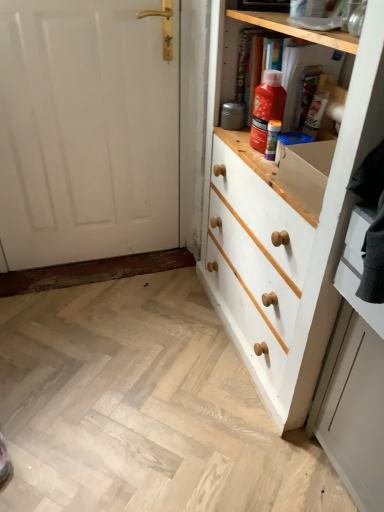
Where is `purple plastic tube at upper center`? The width and height of the screenshot is (384, 512). purple plastic tube at upper center is located at coordinates (272, 139).

The width and height of the screenshot is (384, 512). In order to click on white painted wood chest of drawers at right in this screenshot , I will do pyautogui.click(x=293, y=244).

In order to face white painted wood chest of drawers at right, should I rotate leftwards or rightwards?

You should rotate right by 13.302 degrees.

I want to click on white painted wood drawer at right, so click(357, 269).

Is matte orange plastic bottle at upper center outside of purple plastic tube at upper center?

matte orange plastic bottle at upper center lies outside purple plastic tube at upper center's area.

Is matte orange plastic bottle at upper center bigger than purple plastic tube at upper center?

Correct, matte orange plastic bottle at upper center is larger in size than purple plastic tube at upper center.

Is matte orange plastic bottle at upper center not near purple plastic tube at upper center?

No.

From the image's perspective, who appears lower, matte orange plastic bottle at upper center or purple plastic tube at upper center?

purple plastic tube at upper center.

From the image's perspective, between white painted wood drawer at right and white painted wood door at left, which one is located above?

From the image's view, white painted wood door at left is above.

Is white painted wood drawer at right further to camera compared to white painted wood door at left?

No.

Looking at this image, considering the relative sizes of white painted wood drawer at right and white painted wood door at left in the image provided, is white painted wood drawer at right shorter than white painted wood door at left?

Yes, white painted wood drawer at right is shorter than white painted wood door at left.

Is white painted wood drawer at right at the back of white painted wood door at left?

white painted wood door at left does not have its back to white painted wood drawer at right.

Consider the image. From the image's perspective, which one is positioned lower, white painted wood door at left or white painted wood drawer at right?

white painted wood drawer at right appears lower in the image.

Considering the sizes of objects white painted wood door at left and white painted wood drawer at right in the image provided, who is bigger, white painted wood door at left or white painted wood drawer at right?

white painted wood door at left.

Which object is further away from the camera taking this photo, white painted wood door at left or white painted wood drawer at right?

Positioned behind is white painted wood door at left.

Who is shorter, white painted wood door at left or white painted wood chest of drawers at right?

Standing shorter between the two is white painted wood door at left.

Which object is further away from the camera, white painted wood door at left or white painted wood chest of drawers at right?

white painted wood door at left is more distant.

Consider the image. How different are the orientations of white painted wood door at left and white painted wood chest of drawers at right in degrees?

white painted wood door at left and white painted wood chest of drawers at right are facing 88.9 degrees away from each other.

Can you confirm if purple plastic tube at upper center is positioned to the right of white painted wood door at left?

Indeed, purple plastic tube at upper center is positioned on the right side of white painted wood door at left.

Considering the positions of point (270, 150) and point (132, 184), is point (270, 150) closer or farther from the camera than point (132, 184)?

Point (270, 150) is closer to the camera than point (132, 184).

Locate an element on the screen. Image resolution: width=384 pixels, height=512 pixels. door located underneath the purple plastic tube at upper center (from a real-world perspective) is located at coordinates (86, 131).

Is white painted wood chest of drawers at right further to camera compared to white painted wood door at left?

That is False.

Can you tell me how much white painted wood chest of drawers at right and white painted wood door at left differ in facing direction?

The angle between the facing direction of white painted wood chest of drawers at right and the facing direction of white painted wood door at left is 88.9 degrees.

Is there a large distance between white painted wood chest of drawers at right and white painted wood door at left?

That's not correct — white painted wood chest of drawers at right is a little close to white painted wood door at left.

Between point (233, 213) and point (94, 188), which one is positioned in front?

Positioned in front is point (233, 213).

From a real-world perspective, is purple plastic tube at upper center under white painted wood chest of drawers at right?

No, from a real-world perspective, purple plastic tube at upper center is not under white painted wood chest of drawers at right.

Is purple plastic tube at upper center surrounding white painted wood chest of drawers at right?

No, white painted wood chest of drawers at right is not a part of purple plastic tube at upper center.

Which object is positioned more to the right, purple plastic tube at upper center or white painted wood chest of drawers at right?

From the viewer's perspective, white painted wood chest of drawers at right appears more on the right side.

From the picture: Is purple plastic tube at upper center wider or thinner than white painted wood chest of drawers at right?

Clearly, purple plastic tube at upper center has less width compared to white painted wood chest of drawers at right.

Locate an element on the screen. Image resolution: width=384 pixels, height=512 pixels. bottle that is below the matte orange plastic bottle at upper center (from the image's perspective) is located at coordinates (272, 139).

Where is `door above the white painted wood drawer at right (from the image's perspective)`? door above the white painted wood drawer at right (from the image's perspective) is located at coordinates tap(86, 131).

Based on their spatial positions, is white painted wood door at left or purple plastic tube at upper center further from white painted wood drawer at right?

Among the two, white painted wood door at left is located further to white painted wood drawer at right.

Estimate the real-world distances between objects in this image. Which object is closer to purple plastic tube at upper center, white painted wood door at left or white painted wood drawer at right?

The object closer to purple plastic tube at upper center is white painted wood drawer at right.

Based on their spatial positions, is white painted wood drawer at right or white painted wood door at left further from purple plastic tube at upper center?

white painted wood door at left lies further to purple plastic tube at upper center than the other object.

Based on their spatial positions, is matte orange plastic bottle at upper center or purple plastic tube at upper center closer to white painted wood chest of drawers at right?

matte orange plastic bottle at upper center is positioned closer to the anchor white painted wood chest of drawers at right.

Considering their positions, is white painted wood chest of drawers at right positioned further to white painted wood door at left than matte orange plastic bottle at upper center?

matte orange plastic bottle at upper center is positioned further to the anchor white painted wood door at left.

Based on their spatial positions, is white painted wood drawer at right or white painted wood chest of drawers at right further from white painted wood door at left?

The object further to white painted wood door at left is white painted wood drawer at right.

When comparing their distances from purple plastic tube at upper center, does white painted wood door at left or matte orange plastic bottle at upper center seem closer?

matte orange plastic bottle at upper center is closer to purple plastic tube at upper center.

Considering their positions, is white painted wood chest of drawers at right positioned closer to white painted wood drawer at right than purple plastic tube at upper center?

The object closer to white painted wood drawer at right is white painted wood chest of drawers at right.

Where is `chest of drawers between white painted wood door at left and white painted wood drawer at right`? This screenshot has width=384, height=512. chest of drawers between white painted wood door at left and white painted wood drawer at right is located at coordinates (293, 244).

Identify the location of cleaning product between white painted wood chest of drawers at right and purple plastic tube at upper center along the z-axis. The width and height of the screenshot is (384, 512). (266, 108).

At what (x,y) coordinates should I click in order to perform the action: click on cleaning product between white painted wood door at left and purple plastic tube at upper center from left to right. Please return your answer as a coordinate pair (x, y). The image size is (384, 512). Looking at the image, I should click on coord(266,108).

Where is `bottle between white painted wood door at left and white painted wood chest of drawers at right`? This screenshot has height=512, width=384. bottle between white painted wood door at left and white painted wood chest of drawers at right is located at coordinates (272, 139).